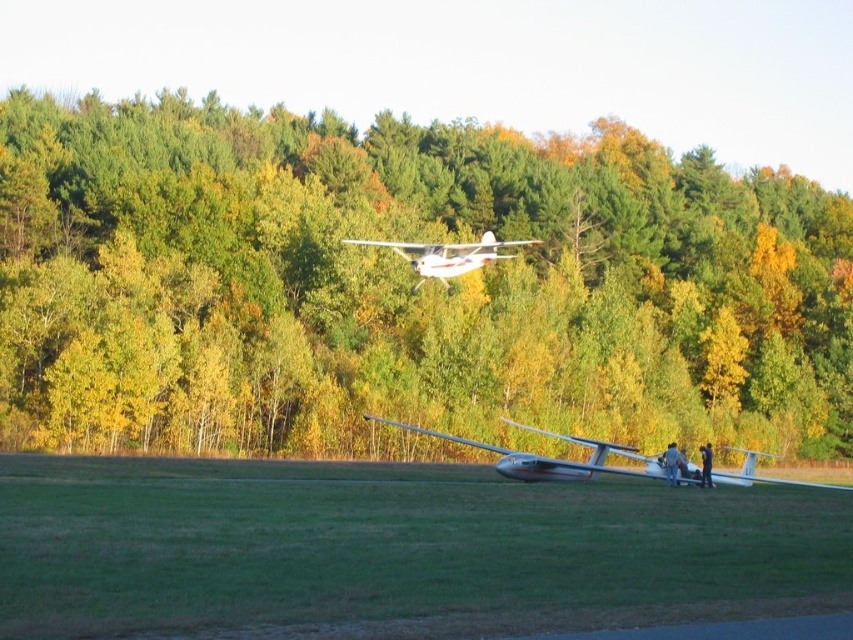
Question: Does silver metallic glider at lower center lie in front of white matte airplane at upper center?

Choices:
 (A) yes
 (B) no

Answer: (A)

Question: Can you confirm if green grass at lower center is positioned below silver metallic glider at lower center?

Choices:
 (A) no
 (B) yes

Answer: (A)

Question: Which is nearer to the silver metallic glider at lower center?

Choices:
 (A) green grass at lower center
 (B) white matte airplane at upper center
 (C) green matte trees at upper center

Answer: (A)

Question: Where is silver metallic glider at lower center located in relation to white matte airplane at upper center in the image?

Choices:
 (A) below
 (B) above

Answer: (A)

Question: Which point is farther to the camera?

Choices:
 (A) white matte airplane at upper center
 (B) silver metallic glider at lower center
 (C) green grass at lower center

Answer: (A)

Question: Estimate the real-world distances between objects in this image. Which object is closer to the green grass at lower center?

Choices:
 (A) silver metallic glider at lower center
 (B) green matte trees at upper center
 (C) white matte airplane at upper center

Answer: (A)